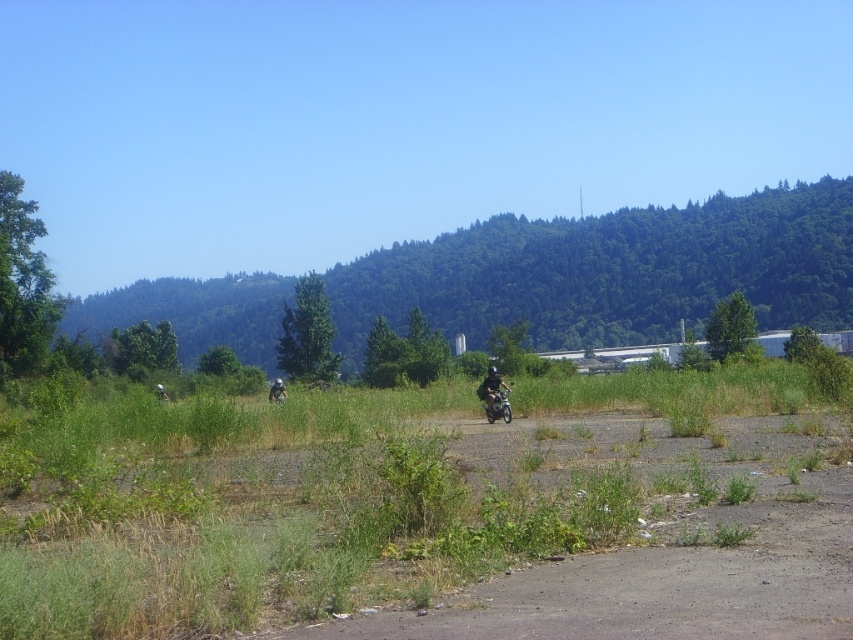
Does metallic silver helmet at center appear over light gray helmeted person at center?

Yes, metallic silver helmet at center is above light gray helmeted person at center.

Is metallic silver helmet at center taller than light gray helmeted person at center?

No, metallic silver helmet at center is not taller than light gray helmeted person at center.

The height and width of the screenshot is (640, 853). What are the coordinates of `metallic silver helmet at center` in the screenshot? It's located at (494, 396).

Who is lower down, gravelly brown dirt field at center or metallic silver helmet at center?

metallic silver helmet at center is lower down.

This screenshot has height=640, width=853. Describe the element at coordinates (491, 547) in the screenshot. I see `gravelly brown dirt field at center` at that location.

At what (x,y) coordinates should I click in order to perform the action: click on gravelly brown dirt field at center. Please return your answer as a coordinate pair (x, y). Image resolution: width=853 pixels, height=640 pixels. Looking at the image, I should click on (491, 547).

Can you confirm if gravelly brown dirt field at center is taller than light gray helmeted person at center?

No, gravelly brown dirt field at center is not taller than light gray helmeted person at center.

This screenshot has width=853, height=640. Identify the location of gravelly brown dirt field at center. click(x=491, y=547).